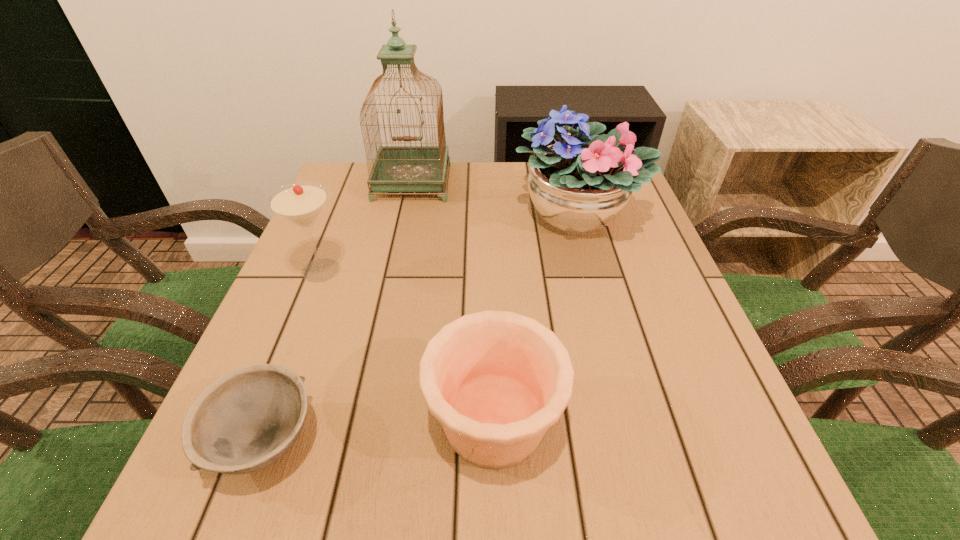
Find the location of a particular element. the tallest object is located at coordinates (404, 168).

At what (x,y) coordinates should I click in order to perform the action: click on the fourth shortest object. Please return your answer as a coordinate pair (x, y). Looking at the image, I should click on pyautogui.click(x=579, y=185).

This screenshot has width=960, height=540. I want to click on the third tallest object, so click(x=300, y=203).

Identify the location of pottery. (496, 380).

Identify the location of the shortest object. Image resolution: width=960 pixels, height=540 pixels. (246, 420).

Where is `vacant space located at the door of the tallest object`? vacant space located at the door of the tallest object is located at coordinates (384, 313).

Identify the location of vacant space located on the front of the bouquet. (619, 372).

Find the location of a particular element. This screenshot has height=540, width=960. free space located on the right of the martini is located at coordinates (533, 270).

The width and height of the screenshot is (960, 540). Identify the location of vacant area located on the back of the fourth tallest object. (490, 244).

Find the location of a particular element. This screenshot has width=960, height=540. vacant position located on the right of the bowl is located at coordinates (507, 441).